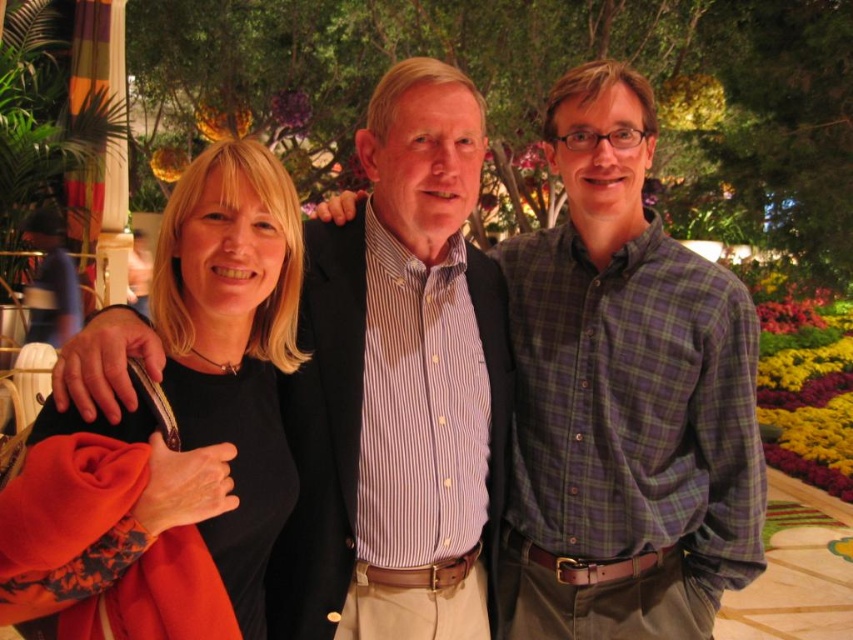
Can you confirm if purple flannel shirt at center is shorter than black matte shirt at left?

No.

Can you confirm if purple flannel shirt at center is taller than black matte shirt at left?

Yes, purple flannel shirt at center is taller than black matte shirt at left.

You are a GUI agent. You are given a task and a screenshot of the screen. Output one action in this format:
    pyautogui.click(x=<x>, y=<y>)
    Task: Click on the purple flannel shirt at center
    The image size is (853, 640).
    Given the screenshot: What is the action you would take?
    pyautogui.click(x=624, y=397)